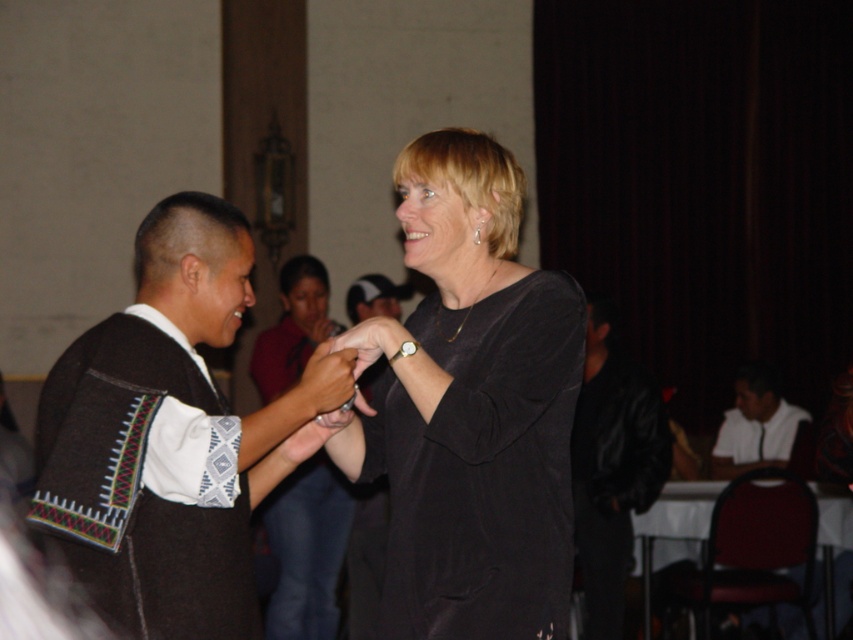
You are standing in the center of the room and see the point marked at coordinates (474, 410). What object is located at that point?

The point at coordinates (474, 410) corresponds to the black matte dress at center.

You are at a party and need to decide which item to take with you. The knitted wool sweater at left and the black leather jacket at right are both available. If you want to take the one closer to the entrance, which should you choose?

The knitted wool sweater at left is positioned on the left side of black leather jacket at right. Since the entrance is typically located on the left side of a room, the knitted wool sweater at left is closer to the entrance and should be chosen.